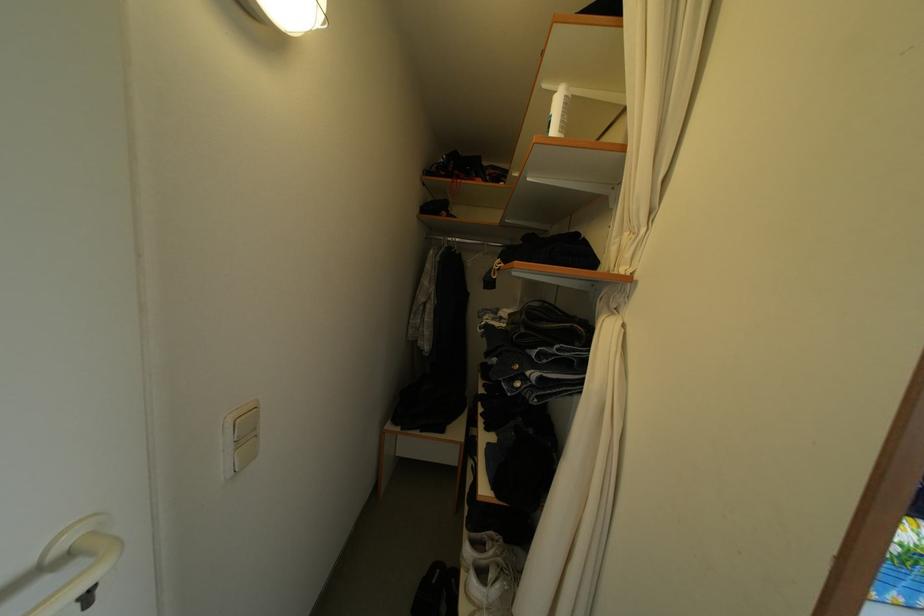
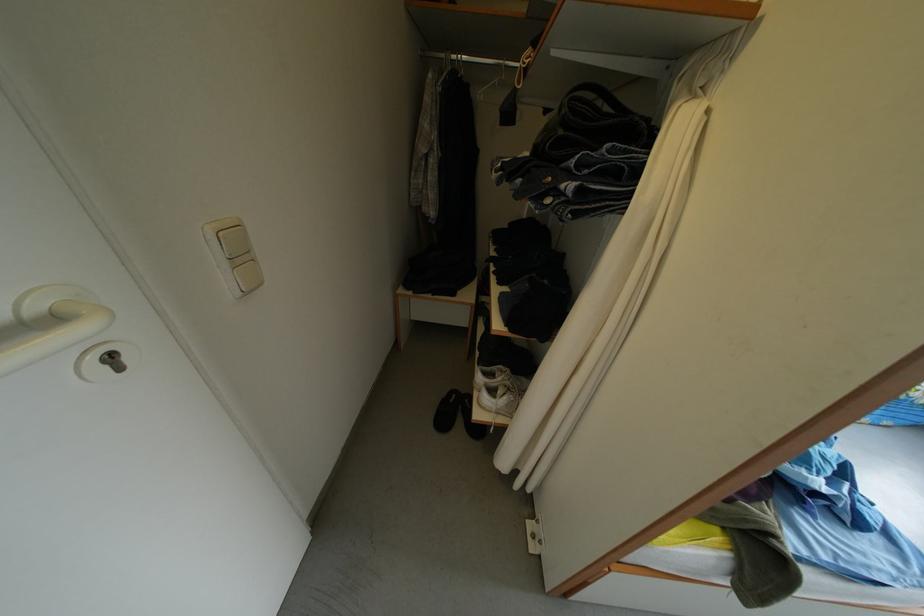
Find the pixel in the second image that matches (492,583) in the first image.

(503, 400)